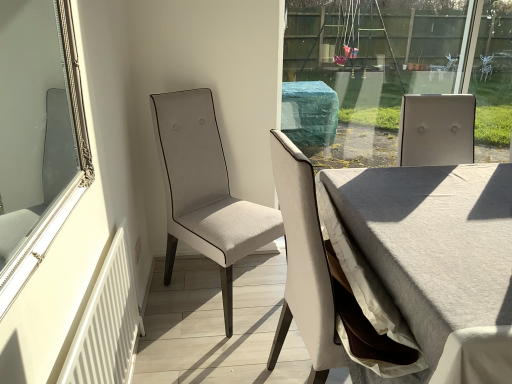
Question: Considering the relative positions of white fabric chair at center, positioned as the first chair in back-to-front order, and light beige fabric chair at center, which ranks as the 2th chair in back-to-front order, in the image provided, is white fabric chair at center, positioned as the first chair in back-to-front order, to the left or to the right of light beige fabric chair at center, which ranks as the 2th chair in back-to-front order,?

Choices:
 (A) right
 (B) left

Answer: (B)

Question: Is white fabric chair at center, positioned as the first chair in back-to-front order, inside the boundaries of light beige fabric chair at center, which appears as the 1th chair when viewed from the front, or outside?

Choices:
 (A) outside
 (B) inside

Answer: (A)

Question: Based on their relative distances, which object is farther from the silver/golden mirror at left?

Choices:
 (A) white textured radiator at lower left
 (B) light beige fabric chair at center, which appears as the 1th chair when viewed from the front
 (C) white fabric chair at center, positioned as the first chair in back-to-front order
 (D) light gray fabric table at center

Answer: (D)

Question: Which is farther from the silver/golden mirror at left?

Choices:
 (A) white textured radiator at lower left
 (B) white fabric chair at center, positioned as the first chair in back-to-front order
 (C) light beige fabric chair at center, which ranks as the 2th chair in back-to-front order
 (D) light gray fabric table at center

Answer: (D)